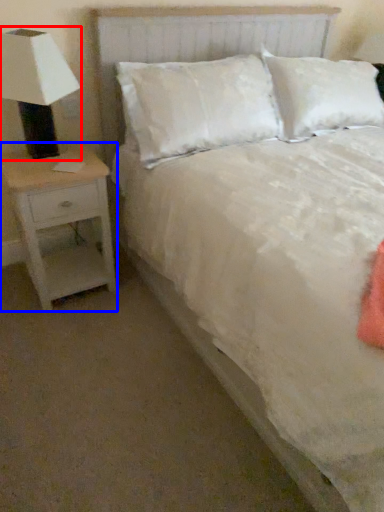
Question: Which object is further to the camera taking this photo, lamp (highlighted by a red box) or nightstand (highlighted by a blue box)?

Choices:
 (A) lamp
 (B) nightstand

Answer: (B)